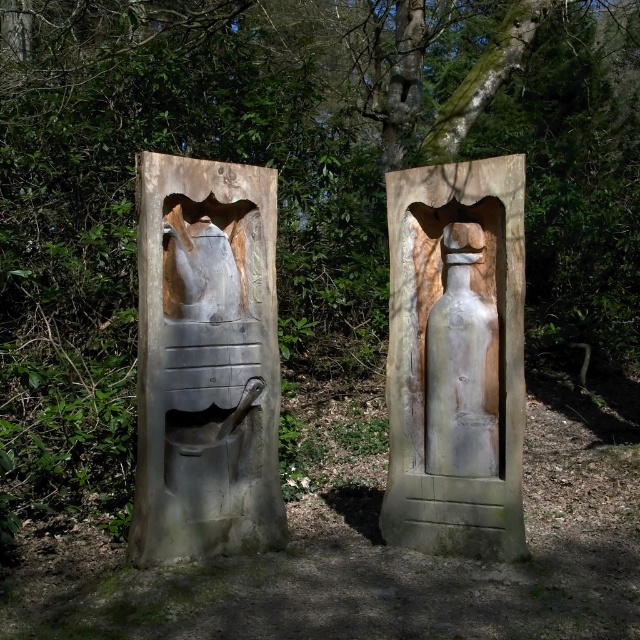
You are an artist planning to place a new sculpture between the white stone bottle at center and the white matte bottle at center. Which bottle should you place the sculpture closer to if you want it to be visually balanced with the larger object?

You should place the sculpture closer to the white stone bottle at center since it is larger in size than the white matte bottle at center, creating a balanced visual composition.

You are setting up a small table for a picnic and have both the matte gray stone pitcher at center and the white matte bottle at center. Which one should you choose if you need a taller container to hold more liquid?

The matte gray stone pitcher at center is taller than the white matte bottle at center, so it can hold more liquid and is the better choice.

You are a visitor in a garden and want to pour water from the matte gray stone pitcher at center into the white stone bottle at center. Can you do this without moving either object?

The matte gray stone pitcher at center is in front of the white stone bottle at center, so you can pour water into the bottle without moving either object.